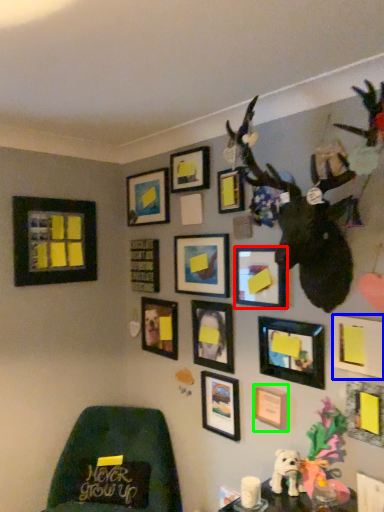
Question: Based on their relative distances, which object is farther from picture frame (highlighted by a red box)? Choose from picture frame (highlighted by a blue box) and picture frame (highlighted by a green box).

Choices:
 (A) picture frame
 (B) picture frame

Answer: (B)